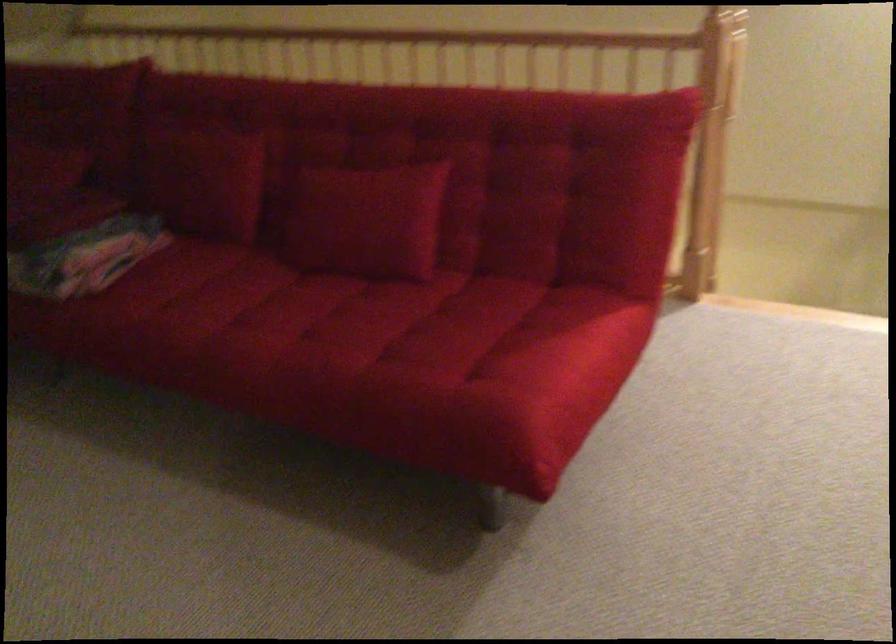
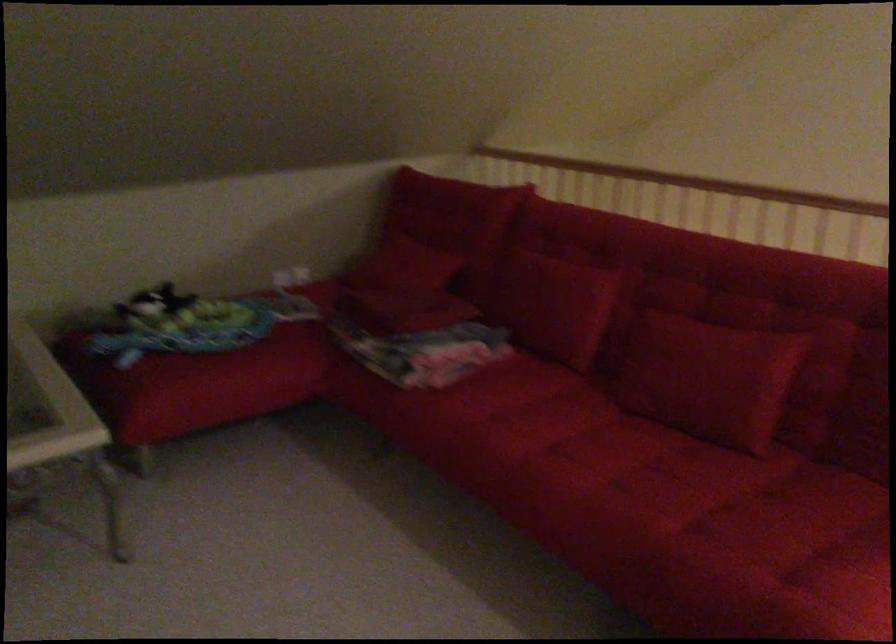
Find the pixel in the second image that matches pixel 427 363 in the first image.

(754, 558)